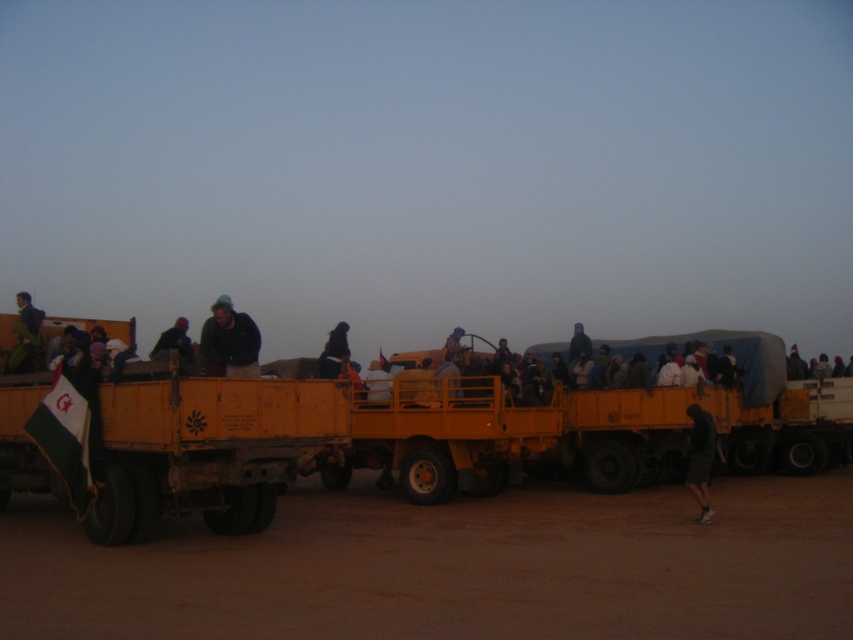
You are a passenger in one of the trucks and want to move to the blue fabric at center without stepping on the black fabric at center. Which direction should you move towards?

The black fabric at center is positioned on the left side of blue fabric at center, so you should move towards the right side to avoid stepping on the black fabric at center.

You are standing in the desert scene and want to walk from the point at coordinates point (328, 337) to the point at coordinates point (569, 352). Which direction should you face to move towards the second point?

You should face downward because point (328, 337) is further to the camera than point (569, 352), so moving towards the second point requires going in the direction away from the camera.

You are standing at the point with coordinates point (453, 349) and want to walk to the point with coordinates point (642, 424). Which direction should you move to reach your destination?

You should move forward because point (642, 424) is in front of point (453, 349).